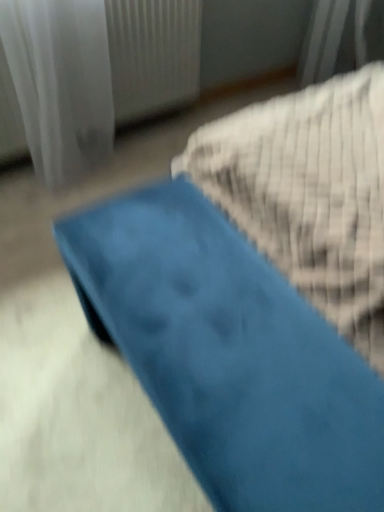
Describe the element at coordinates (229, 355) in the screenshot. I see `blue fabric ottoman at center` at that location.

Image resolution: width=384 pixels, height=512 pixels. Identify the location of blue fabric ottoman at center. (229, 355).

What do you see at coordinates (61, 83) in the screenshot? This screenshot has height=512, width=384. I see `white sheer curtain at upper left` at bounding box center [61, 83].

Where is `white sheer curtain at upper left`? This screenshot has height=512, width=384. white sheer curtain at upper left is located at coordinates (61, 83).

What is the approximate width of white sheer curtain at upper left?

The width of white sheer curtain at upper left is 2.10 inches.

The height and width of the screenshot is (512, 384). What are the coordinates of `blue fabric ottoman at center` in the screenshot? It's located at (229, 355).

Considering the relative positions of blue fabric ottoman at center and white sheer curtain at upper left in the image provided, is blue fabric ottoman at center to the left of white sheer curtain at upper left from the viewer's perspective?

No, blue fabric ottoman at center is not to the left of white sheer curtain at upper left.

Is the depth of blue fabric ottoman at center greater than that of white sheer curtain at upper left?

No, blue fabric ottoman at center is closer to the camera.

Considering the points (223, 397) and (54, 35), which point is in front, point (223, 397) or point (54, 35)?

The point (223, 397) is closer to the camera.

From the image's perspective, is blue fabric ottoman at center above or below white sheer curtain at upper left?

blue fabric ottoman at center is below white sheer curtain at upper left.

From a real-world perspective, relative to white sheer curtain at upper left, is blue fabric ottoman at center vertically above or below?

blue fabric ottoman at center is situated lower than white sheer curtain at upper left in the real world.

Is blue fabric ottoman at center thinner than white sheer curtain at upper left?

In fact, blue fabric ottoman at center might be wider than white sheer curtain at upper left.

Which of these two, blue fabric ottoman at center or white sheer curtain at upper left, stands shorter?

blue fabric ottoman at center.

Does blue fabric ottoman at center have a smaller size compared to white sheer curtain at upper left?

No, blue fabric ottoman at center is not smaller than white sheer curtain at upper left.

Is white sheer curtain at upper left completely or partially inside blue fabric ottoman at center?

No, blue fabric ottoman at center does not contain white sheer curtain at upper left.

Is blue fabric ottoman at center next to white sheer curtain at upper left?

blue fabric ottoman at center is not next to white sheer curtain at upper left, and they're not touching.

Looking at this image, could you tell me if blue fabric ottoman at center is turned towards white sheer curtain at upper left?

No, blue fabric ottoman at center is not turned towards white sheer curtain at upper left.

How many degrees apart are the facing directions of blue fabric ottoman at center and white sheer curtain at upper left?

90 degrees separate the facing orientations of blue fabric ottoman at center and white sheer curtain at upper left.

Identify the location of furniture on the right of white sheer curtain at upper left. (229, 355).

Based on the photo, is white sheer curtain at upper left to the left or to the right of blue fabric ottoman at center in the image?

Based on their positions, white sheer curtain at upper left is located to the left of blue fabric ottoman at center.

Considering the relative positions of white sheer curtain at upper left and blue fabric ottoman at center in the image provided, is white sheer curtain at upper left in front of blue fabric ottoman at center?

No, white sheer curtain at upper left is further to the viewer.

Which is closer to the camera, (29,11) or (266,407)?

Point (29,11) is farther from the camera than point (266,407).

From the image's perspective, between white sheer curtain at upper left and blue fabric ottoman at center, which one is located above?

white sheer curtain at upper left appears higher in the image.

From a real-world perspective, is white sheer curtain at upper left on blue fabric ottoman at center?

Yes, from a real-world perspective, white sheer curtain at upper left is over blue fabric ottoman at center

Based on the photo, looking at their sizes, would you say white sheer curtain at upper left is wider or thinner than blue fabric ottoman at center?

Clearly, white sheer curtain at upper left has less width compared to blue fabric ottoman at center.

In the scene shown: Considering the relative sizes of white sheer curtain at upper left and blue fabric ottoman at center in the image provided, is white sheer curtain at upper left taller than blue fabric ottoman at center?

Indeed, white sheer curtain at upper left has a greater height compared to blue fabric ottoman at center.

Between white sheer curtain at upper left and blue fabric ottoman at center, which one has larger size?

blue fabric ottoman at center is bigger.

Is white sheer curtain at upper left not inside blue fabric ottoman at center?

Yes, white sheer curtain at upper left is not within blue fabric ottoman at center.

Is white sheer curtain at upper left not near blue fabric ottoman at center?

They are positioned close to each other.

Is white sheer curtain at upper left oriented away from blue fabric ottoman at center?

No, white sheer curtain at upper left is not facing away from blue fabric ottoman at center.

The image size is (384, 512). I want to click on curtain that appears on the left of blue fabric ottoman at center, so click(x=61, y=83).

The width and height of the screenshot is (384, 512). I want to click on furniture that appears below the white sheer curtain at upper left (from a real-world perspective), so click(x=229, y=355).

You are a GUI agent. You are given a task and a screenshot of the screen. Output one action in this format:
    pyautogui.click(x=<x>, y=<y>)
    Task: Click on the curtain behind the blue fabric ottoman at center
    The width and height of the screenshot is (384, 512).
    Given the screenshot: What is the action you would take?
    pyautogui.click(x=61, y=83)